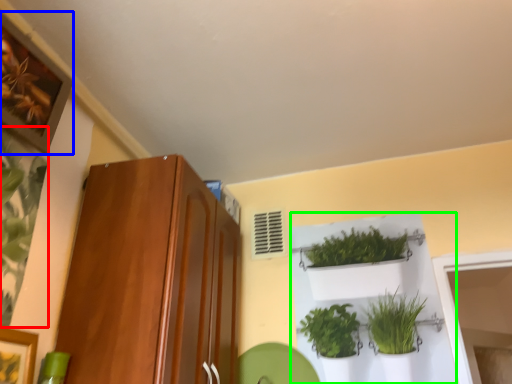
Question: Based on their relative distances, which object is farther from plant (highlighted by a red box)? Choose from picture frame (highlighted by a blue box) and shelf (highlighted by a green box).

Choices:
 (A) picture frame
 (B) shelf

Answer: (B)